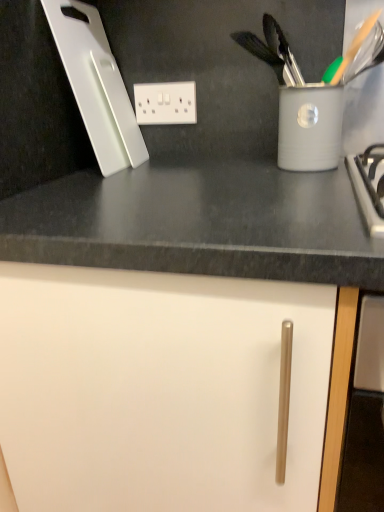
Question: Considering the relative sizes of white plastic cutting board at upper left and white plastic electric outlet at upper center in the image provided, is white plastic cutting board at upper left bigger than white plastic electric outlet at upper center?

Choices:
 (A) yes
 (B) no

Answer: (A)

Question: Considering the relative sizes of white plastic cutting board at upper left and white plastic electric outlet at upper center in the image provided, is white plastic cutting board at upper left wider than white plastic electric outlet at upper center?

Choices:
 (A) yes
 (B) no

Answer: (A)

Question: Does white plastic cutting board at upper left have a lesser height compared to white plastic electric outlet at upper center?

Choices:
 (A) no
 (B) yes

Answer: (A)

Question: Can you confirm if white plastic cutting board at upper left is smaller than white plastic electric outlet at upper center?

Choices:
 (A) no
 (B) yes

Answer: (A)

Question: Is white plastic cutting board at upper left to the right of white plastic electric outlet at upper center from the viewer's perspective?

Choices:
 (A) no
 (B) yes

Answer: (A)

Question: Are white plastic cutting board at upper left and white plastic electric outlet at upper center beside each other?

Choices:
 (A) yes
 (B) no

Answer: (B)

Question: Is white plastic electric outlet at upper center bigger than white matte cabinet door at center?

Choices:
 (A) yes
 (B) no

Answer: (B)

Question: Is white plastic electric outlet at upper center further to the viewer compared to white matte cabinet door at center?

Choices:
 (A) no
 (B) yes

Answer: (B)

Question: Is white plastic electric outlet at upper center outside of white matte cabinet door at center?

Choices:
 (A) yes
 (B) no

Answer: (A)

Question: From a real-world perspective, does white plastic electric outlet at upper center sit lower than white matte cabinet door at center?

Choices:
 (A) yes
 (B) no

Answer: (B)

Question: From the image's perspective, is white plastic electric outlet at upper center located above white matte cabinet door at center?

Choices:
 (A) yes
 (B) no

Answer: (A)

Question: Is white plastic electric outlet at upper center oriented away from white matte cabinet door at center?

Choices:
 (A) no
 (B) yes

Answer: (A)

Question: Can you confirm if white plastic electric outlet at upper center is bigger than white plastic cutting board at upper left?

Choices:
 (A) no
 (B) yes

Answer: (A)